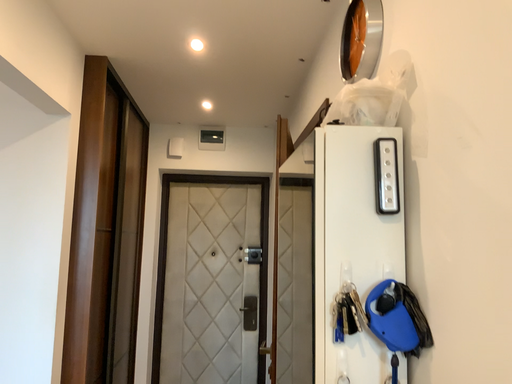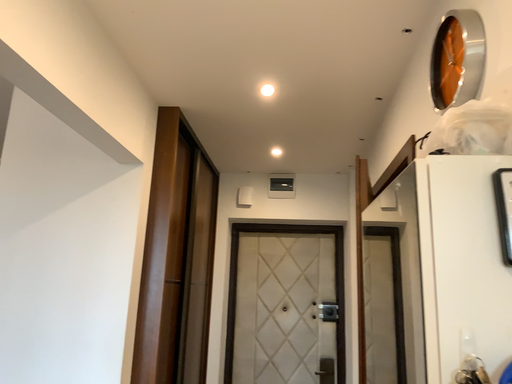
Question: How did the camera likely rotate when shooting the video?

Choices:
 (A) rotated left
 (B) rotated right

Answer: (A)